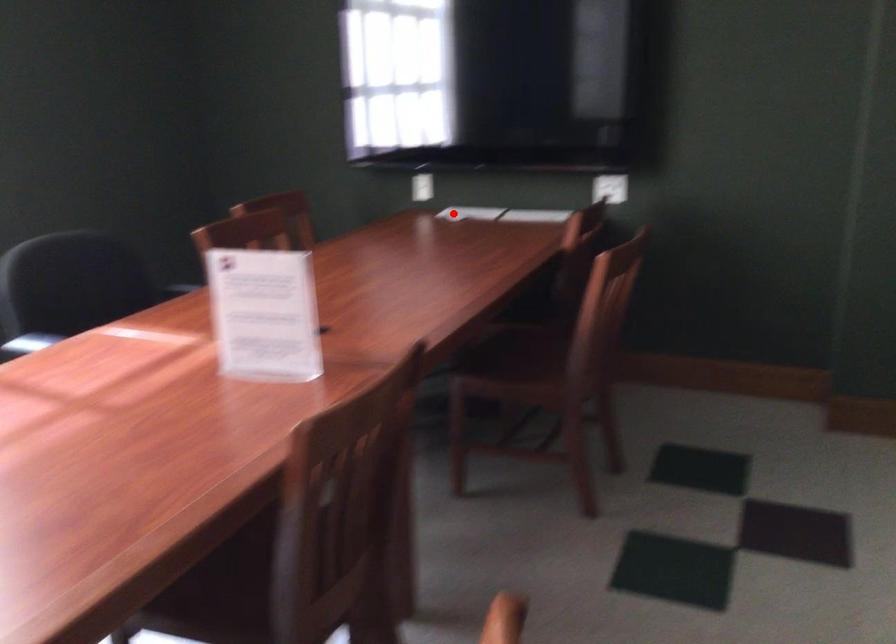
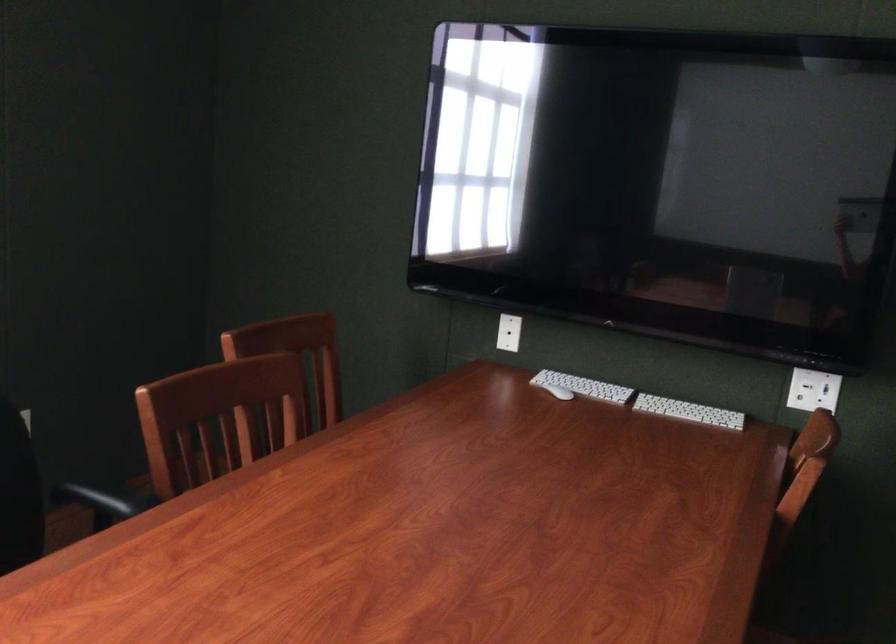
Question: I am providing you with two images of the same scene from different viewpoints. A red point is marked on the first image. At the location where the point appears in image 1, is it still visible in image 2?

Choices:
 (A) Yes
 (B) No

Answer: (A)